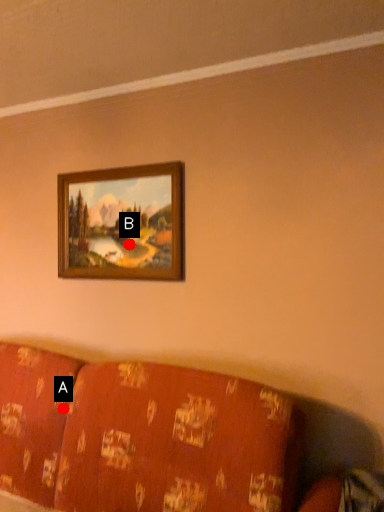
Question: Two points are circled on the image, labeled by A and B beside each circle. Which point is closer to the camera?

Choices:
 (A) A is closer
 (B) B is closer

Answer: (A)